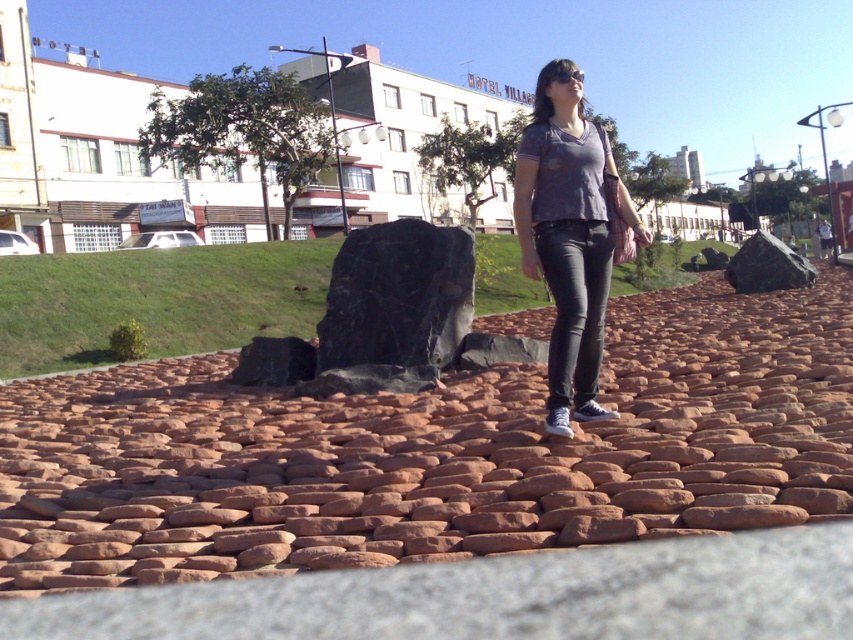
Based on the photo, you are standing at the point marked as point (498, 595) in the image. What is the surface you are standing on?

Result: The surface at point (498, 595) is the brown stone pavement at center.

You are standing on the red cobblestone pavement at center and want to walk to the black smooth rock at center. Which direction should you move to reach it?

The black smooth rock at center is to the right of the red cobblestone pavement at center, so you should move to the right to reach it.

You are standing on the cobblestone pathway and want to place a small potted plant exactly where the brown stone pavement at center is located. According to the scene description, where should you place the potted plant?

You should place the potted plant at the coordinates point (498, 595) where the brown stone pavement at center is located.